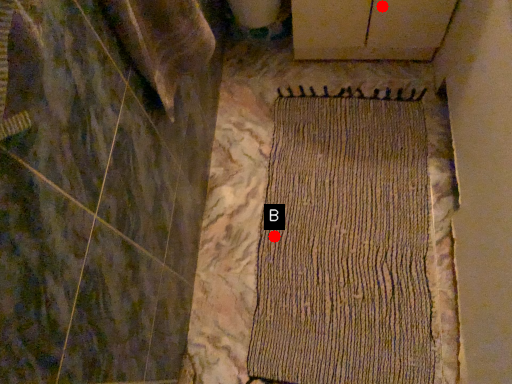
Question: Two points are circled on the image, labeled by A and B beside each circle. Which point is farther to the camera?

Choices:
 (A) A is further
 (B) B is further

Answer: (B)